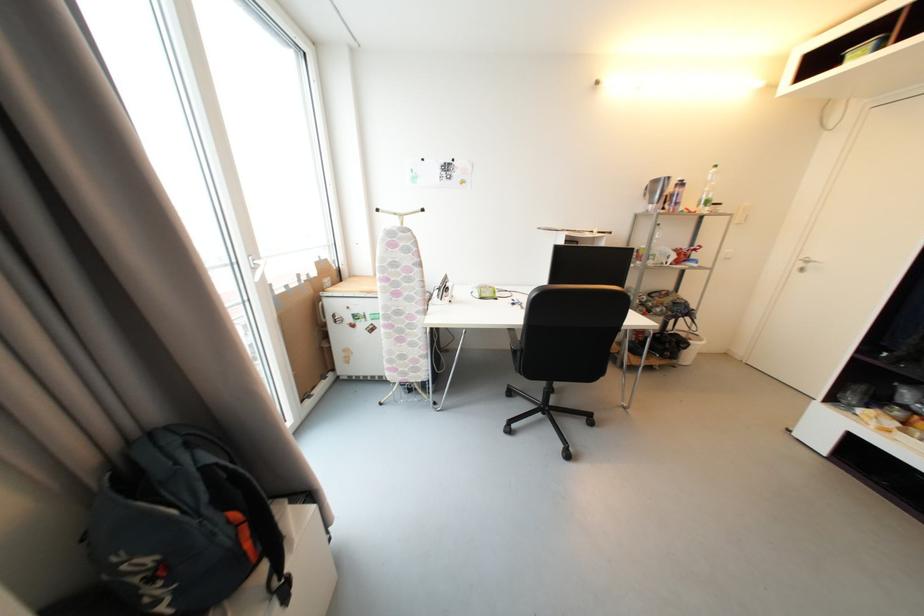
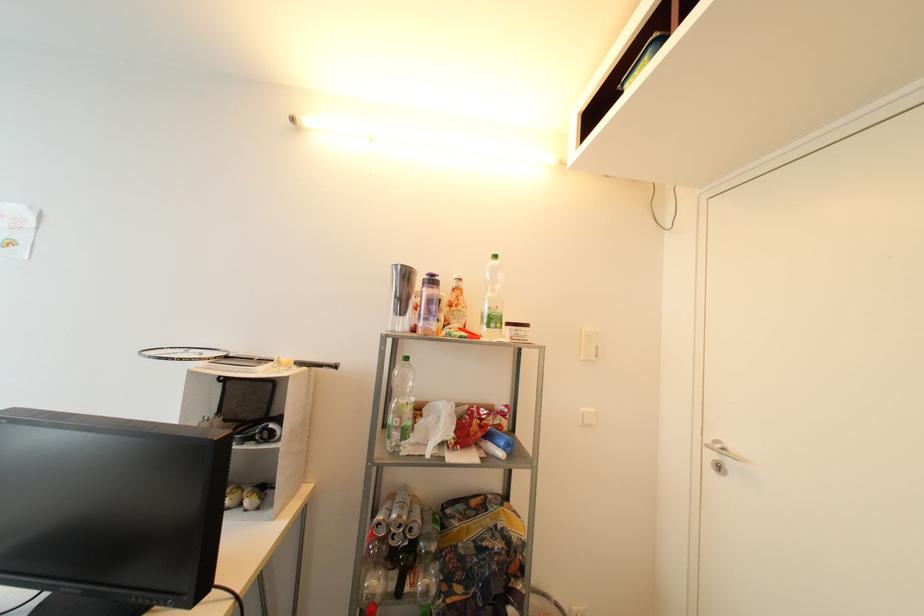
Where in the second image is the point corresponding to the point at 687,185 from the first image?

(438, 283)